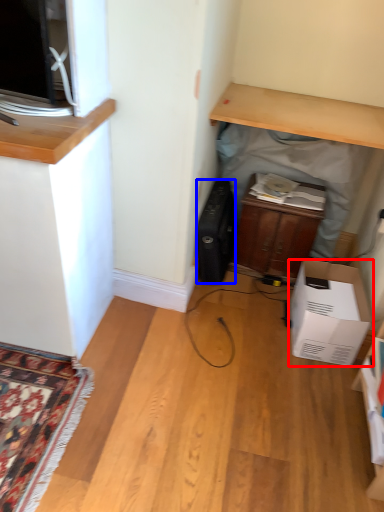
Question: Among these objects, which one is farthest to the camera, cardboard box (highlighted by a red box) or appliance (highlighted by a blue box)?

Choices:
 (A) cardboard box
 (B) appliance

Answer: (B)